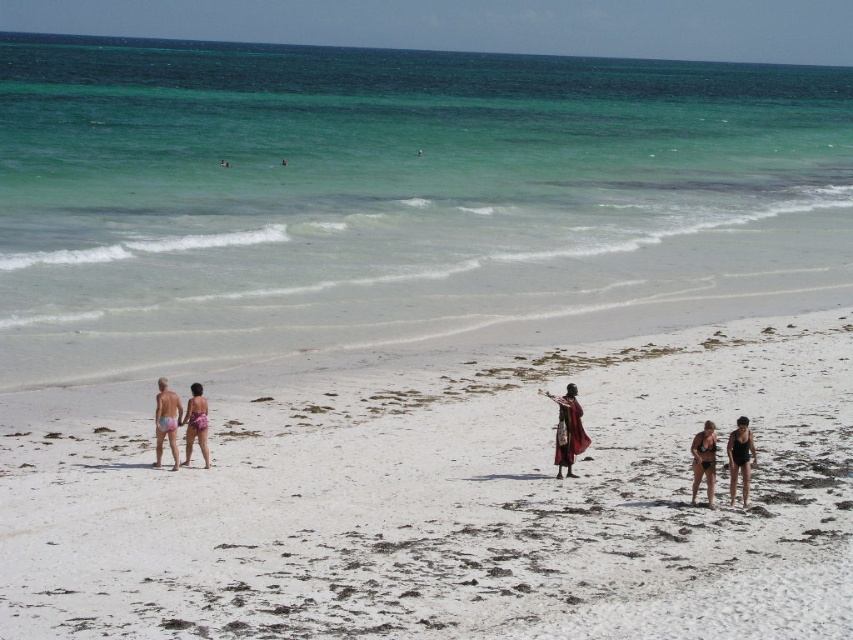
Is pink fabric shorts at left bigger than matte black bikini at lower right?

Actually, pink fabric shorts at left might be smaller than matte black bikini at lower right.

Is pink fabric shorts at left above matte black bikini at lower right?

Indeed, pink fabric shorts at left is positioned over matte black bikini at lower right.

Measure the distance between pink fabric shorts at left and camera.

pink fabric shorts at left is 22.03 meters from camera.

Locate an element on the screen. pink fabric shorts at left is located at coordinates (166, 420).

Who is higher up, black swimsuit at lower right or matte black bikini at lower right?

black swimsuit at lower right is higher up.

Which is in front, point (740, 426) or point (711, 497)?

Point (711, 497) is in front.

Locate an element on the screen. The height and width of the screenshot is (640, 853). black swimsuit at lower right is located at coordinates (740, 458).

Measure the distance between point [12,266] and camera.

Point [12,266] and camera are 142.00 feet apart.

Is clear water at beach center wider than matte black bikini at lower right?

Yes.

At what (x,y) coordinates should I click in order to perform the action: click on clear water at beach center. Please return your answer as a coordinate pair (x, y). Looking at the image, I should click on pyautogui.click(x=387, y=195).